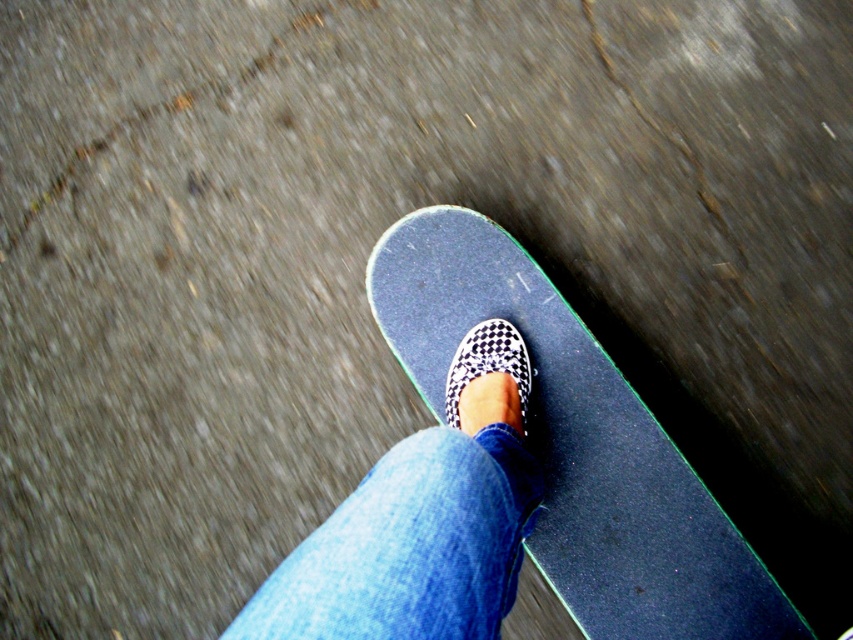
You are a photographer trying to capture the skateboard in the center of the image. The camera has a focus point at coordinate point [577,444]. Will this focus point be effective for capturing the smooth black skateboard at center?

Yes, the focus point at coordinate point [577,444] is effective because it marks the exact location of the smooth black skateboard at center.

You are a photographer trying to capture a clear shot of both the smooth black skateboard at center and the matte black skate shoe at center. Since the skateboard is closer to you, which object should you focus on first to ensure both are in focus?

Since the smooth black skateboard at center is closer to you than the matte black skate shoe at center, you should focus on the smooth black skateboard at center first. This way, adjusting the focus from the closest object outward increases the likelihood of both being in focus.